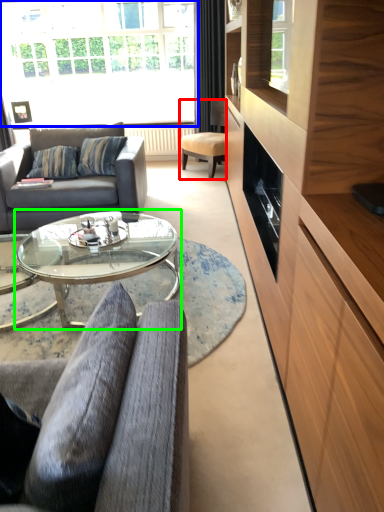
Question: Considering the real-world distances, which object is farthest from chair (highlighted by a red box)? window (highlighted by a blue box) or coffee table (highlighted by a green box)?

Choices:
 (A) window
 (B) coffee table

Answer: (B)